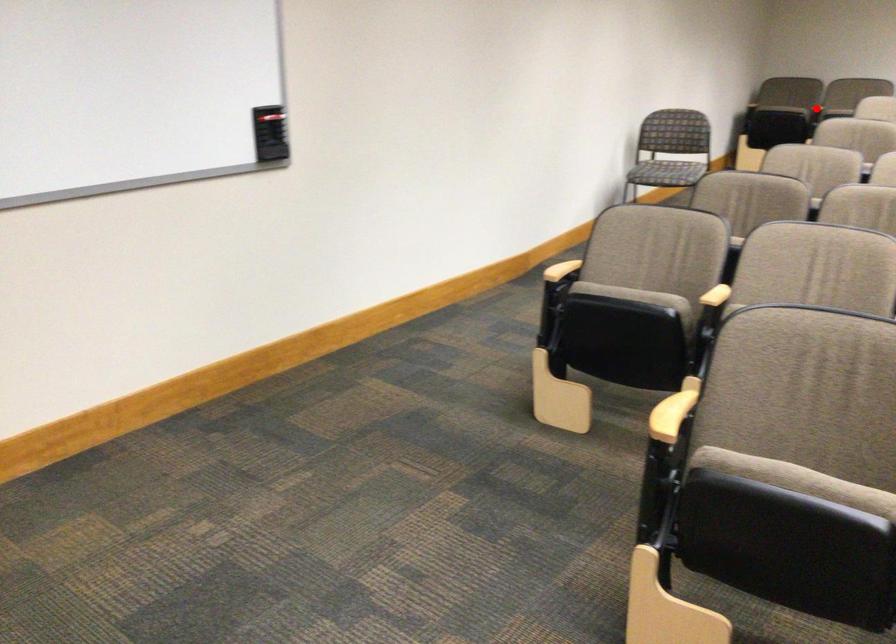
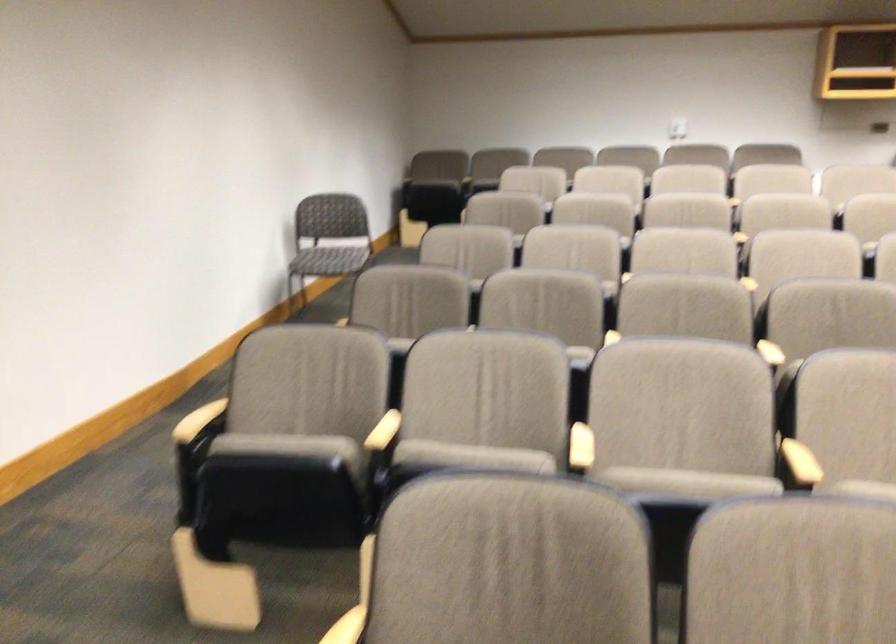
Question: I am providing you with two images of the same scene from different viewpoints. A red point is marked on the first image. At the location where the point appears in image 1, is it still visible in image 2?

Choices:
 (A) Yes
 (B) No

Answer: (B)